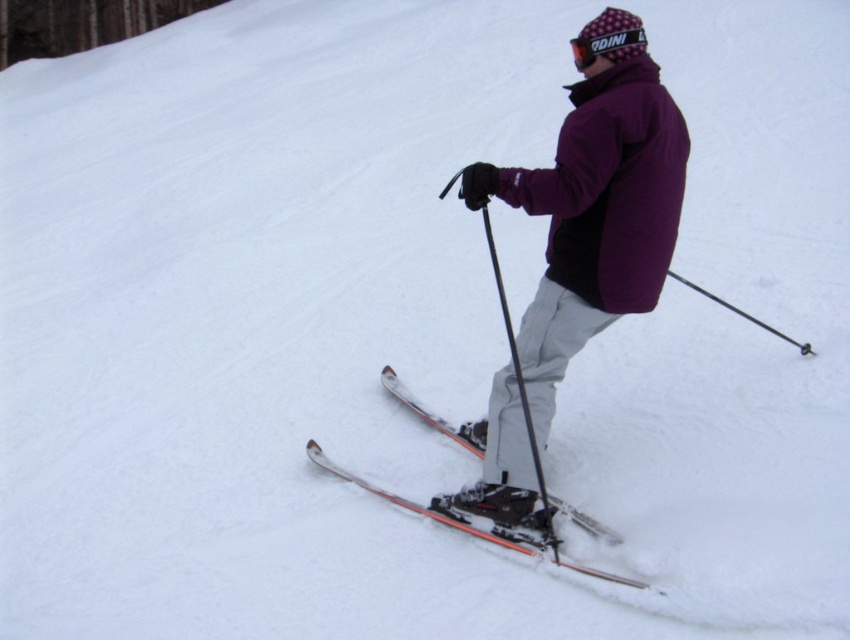
Question: Which object appears farthest from the camera in this image?

Choices:
 (A) orange metallic skis at center
 (B) purple fleece jacket at center

Answer: (A)

Question: Which of the following is the closest to the observer?

Choices:
 (A) orange metallic skis at center
 (B) purple fleece jacket at center

Answer: (B)

Question: Can you confirm if purple fleece jacket at center is wider than orange metallic skis at center?

Choices:
 (A) yes
 (B) no

Answer: (B)

Question: In this image, where is purple fleece jacket at center located relative to orange metallic skis at center?

Choices:
 (A) right
 (B) left

Answer: (A)

Question: Does purple fleece jacket at center have a greater width compared to orange metallic skis at center?

Choices:
 (A) no
 (B) yes

Answer: (A)

Question: Which point appears closest to the camera in this image?

Choices:
 (A) (318, 445)
 (B) (638, 154)

Answer: (B)